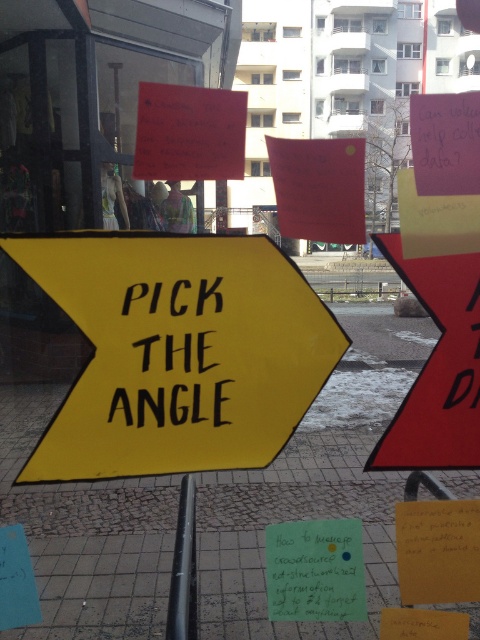
Who is taller, red matte arrow at right or black matte pole at center?

red matte arrow at right

Where is `red matte arrow at right`? Image resolution: width=480 pixels, height=640 pixels. red matte arrow at right is located at coordinates (437, 369).

Is point (468, 332) more distant than point (192, 541)?

No, it is not.

Where is `red matte arrow at right`? The height and width of the screenshot is (640, 480). red matte arrow at right is located at coordinates (437, 369).

Measure the distance between green paper sign at center and camera.

4.35 feet

Is green paper sign at center shorter than black matte text at center?

Correct, green paper sign at center is not as tall as black matte text at center.

Describe the element at coordinates (315, 570) in the screenshot. The width and height of the screenshot is (480, 640). I see `green paper sign at center` at that location.

In order to click on green paper sign at center in this screenshot , I will do `click(315, 570)`.

Can you confirm if yellow matte arrow at center is positioned below black matte text at center?

Correct, yellow matte arrow at center is located below black matte text at center.

Where is `yellow matte arrow at center`? This screenshot has height=640, width=480. yellow matte arrow at center is located at coordinates (178, 353).